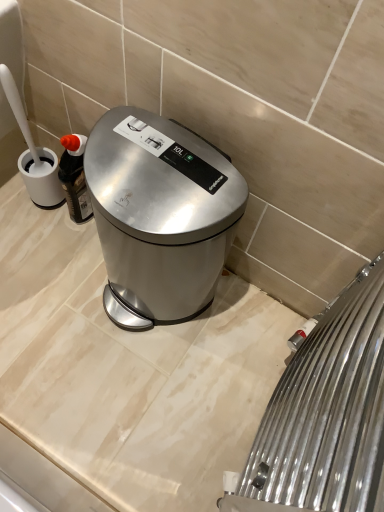
Question: Is satin nickel radiator at lower right spatially inside satin silver trash can at center, or outside of it?

Choices:
 (A) inside
 (B) outside

Answer: (B)

Question: In terms of height, does satin nickel radiator at lower right look taller or shorter compared to satin silver trash can at center?

Choices:
 (A) short
 (B) tall

Answer: (B)

Question: Is satin nickel radiator at lower right in front of or behind satin silver trash can at center in the image?

Choices:
 (A) front
 (B) behind

Answer: (A)

Question: In terms of height, does satin silver trash can at center look taller or shorter compared to satin nickel radiator at lower right?

Choices:
 (A) tall
 (B) short

Answer: (B)

Question: Is satin silver trash can at center bigger or smaller than satin nickel radiator at lower right?

Choices:
 (A) big
 (B) small

Answer: (A)

Question: Is satin silver trash can at center to the left or to the right of satin nickel radiator at lower right in the image?

Choices:
 (A) left
 (B) right

Answer: (A)

Question: From the image's perspective, is satin silver trash can at center positioned above or below satin nickel radiator at lower right?

Choices:
 (A) above
 (B) below

Answer: (A)